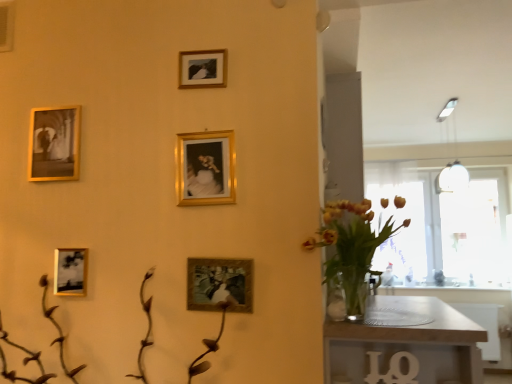
Question: Based on their sizes in the image, would you say matte gold picture frame at center, which is counted as the 1th picture frame, starting from the bottom, is bigger or smaller than gold-framed picture at upper center, which ranks as the 3th picture frame in right-to-left order?

Choices:
 (A) big
 (B) small

Answer: (A)

Question: Is point (245, 306) closer or farther from the camera than point (195, 52)?

Choices:
 (A) closer
 (B) farther

Answer: (A)

Question: Which is nearer to the transparent glass window at right?

Choices:
 (A) transparent glass door at right
 (B) gold metallic picture frame at center, the 4th picture frame positioned from the left
 (C) matte gold picture frame at center, the 5th picture frame positioned from the top
 (D) wooden table at lower right
 (E) gold-framed photo at upper left, arranged as the 1th picture frame when viewed from the left

Answer: (A)

Question: Based on their relative distances, which object is nearer to the transparent glass window at right?

Choices:
 (A) translucent glass vase at right
 (B) matte gold picture frame at center, which is the fifth picture frame from left to right
 (C) gold-framed picture at upper center, the 1th picture frame when ordered from top to bottom
 (D) gold-framed photo at upper left, arranged as the 1th picture frame when viewed from the left
 (E) transparent glass door at right

Answer: (E)